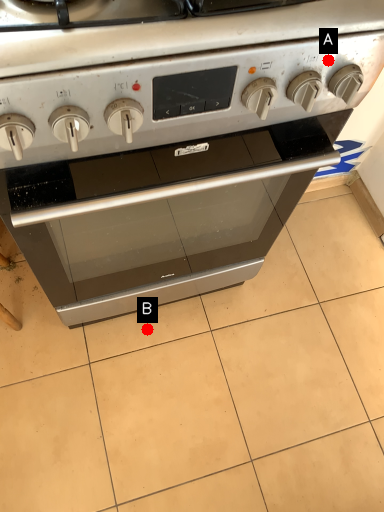
Question: Two points are circled on the image, labeled by A and B beside each circle. Which point is closer to the camera taking this photo?

Choices:
 (A) A is closer
 (B) B is closer

Answer: (A)